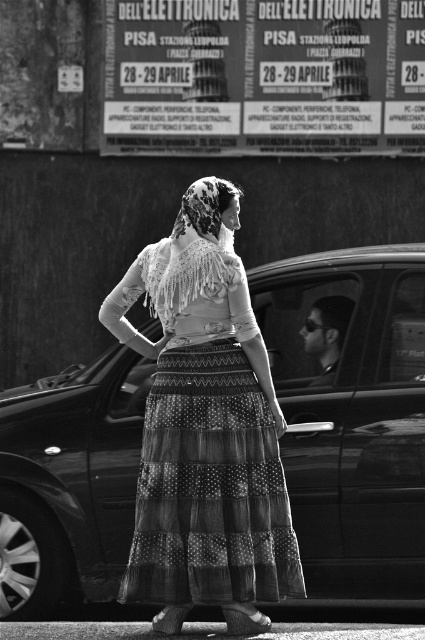
Question: Which of the following is the closest to the observer?

Choices:
 (A) (348, 374)
 (B) (198, 529)
 (C) (295, 81)

Answer: (B)

Question: Does textured cotton dress at center have a lesser width compared to metallic poster at upper center?

Choices:
 (A) yes
 (B) no

Answer: (A)

Question: Does textured cotton dress at center have a greater width compared to metallic poster at upper center?

Choices:
 (A) no
 (B) yes

Answer: (A)

Question: Which point appears farthest from the camera in this image?

Choices:
 (A) (393, 68)
 (B) (147, 566)
 (C) (419, 400)

Answer: (A)

Question: Does metallic car door at center have a smaller size compared to metallic poster at upper center?

Choices:
 (A) yes
 (B) no

Answer: (A)

Question: Among these objects, which one is farthest from the camera?

Choices:
 (A) metallic car door at center
 (B) textured cotton dress at center
 (C) metallic poster at upper center

Answer: (C)